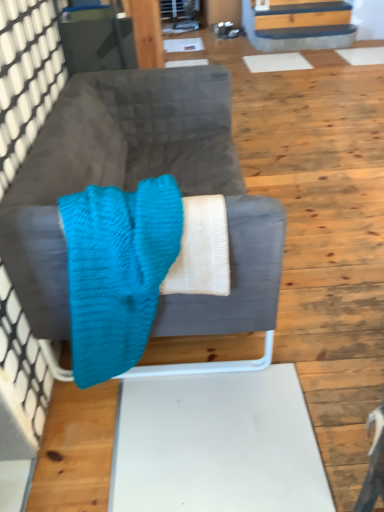
I want to click on turquoise knitted blanket at center, so click(117, 271).

This screenshot has width=384, height=512. Describe the element at coordinates (117, 271) in the screenshot. I see `turquoise knitted blanket at center` at that location.

Where is `velvet gray couch at center`? The width and height of the screenshot is (384, 512). velvet gray couch at center is located at coordinates (135, 188).

What do you see at coordinates (135, 188) in the screenshot? I see `velvet gray couch at center` at bounding box center [135, 188].

What is the approximate height of velvet gray couch at center?

velvet gray couch at center is 70.00 centimeters in height.

Find the location of `turquoise knitted blanket at center`. turquoise knitted blanket at center is located at coordinates (117, 271).

Considering the positions of objects velvet gray couch at center and turquoise knitted blanket at center in the image provided, who is more to the right, velvet gray couch at center or turquoise knitted blanket at center?

Positioned to the right is velvet gray couch at center.

Is velvet gray couch at center in front of or behind turquoise knitted blanket at center in the image?

Visually, velvet gray couch at center is located behind turquoise knitted blanket at center.

Which point is more distant from viewer, (x=104, y=84) or (x=172, y=225)?

Point (x=104, y=84)

From the image's perspective, is velvet gray couch at center on turquoise knitted blanket at center?

Yes, from the image's perspective, velvet gray couch at center is above turquoise knitted blanket at center.

From a real-world perspective, is velvet gray couch at center beneath turquoise knitted blanket at center?

Yes, from a real-world perspective, velvet gray couch at center is under turquoise knitted blanket at center.

Based on the photo, which object is wider, velvet gray couch at center or turquoise knitted blanket at center?

velvet gray couch at center is wider.

Does velvet gray couch at center have a greater height compared to turquoise knitted blanket at center?

Yes.

Who is smaller, velvet gray couch at center or turquoise knitted blanket at center?

With smaller size is turquoise knitted blanket at center.

Is velvet gray couch at center completely or partially outside of turquoise knitted blanket at center?

Absolutely, velvet gray couch at center is external to turquoise knitted blanket at center.

Are velvet gray couch at center and turquoise knitted blanket at center located far from each other?

They are positioned close to each other.

Is velvet gray couch at center oriented away from turquoise knitted blanket at center?

No.

What's the angular difference between velvet gray couch at center and turquoise knitted blanket at center's facing directions?

90.5 degrees separate the facing orientations of velvet gray couch at center and turquoise knitted blanket at center.

Find the location of a particular element. blanket in front of the velvet gray couch at center is located at coordinates (117, 271).

Can you confirm if turquoise knitted blanket at center is positioned to the left of velvet gray couch at center?

Correct, you'll find turquoise knitted blanket at center to the left of velvet gray couch at center.

Is the position of turquoise knitted blanket at center more distant than that of velvet gray couch at center?

That is False.

Does point (132, 334) come behind point (15, 236)?

Yes, point (132, 334) is farther from viewer.

From the image's perspective, is turquoise knitted blanket at center located beneath velvet gray couch at center?

Yes, from the image's perspective, turquoise knitted blanket at center is beneath velvet gray couch at center.

From a real-world perspective, who is located lower, turquoise knitted blanket at center or velvet gray couch at center?

velvet gray couch at center, from a real-world perspective.

Does turquoise knitted blanket at center have a lesser width compared to velvet gray couch at center?

Yes, turquoise knitted blanket at center is thinner than velvet gray couch at center.

Considering the sizes of objects turquoise knitted blanket at center and velvet gray couch at center in the image provided, who is taller, turquoise knitted blanket at center or velvet gray couch at center?

Standing taller between the two is velvet gray couch at center.

In terms of size, does turquoise knitted blanket at center appear bigger or smaller than velvet gray couch at center?

Considering their sizes, turquoise knitted blanket at center takes up less space than velvet gray couch at center.

In the scene shown: Can velvet gray couch at center be found inside turquoise knitted blanket at center?

No, velvet gray couch at center is not a part of turquoise knitted blanket at center.

Is turquoise knitted blanket at center next to velvet gray couch at center and touching it?

No, turquoise knitted blanket at center is not making contact with velvet gray couch at center.

Is turquoise knitted blanket at center facing away from velvet gray couch at center?

Absolutely, turquoise knitted blanket at center is directed away from velvet gray couch at center.

Identify the location of studio couch on the right of turquoise knitted blanket at center. [x=135, y=188].

This screenshot has width=384, height=512. I want to click on blanket lying below the velvet gray couch at center (from the image's perspective), so click(x=117, y=271).

At what (x,y) coordinates should I click in order to perform the action: click on studio couch below the turquoise knitted blanket at center (from a real-world perspective). Please return your answer as a coordinate pair (x, y). This screenshot has height=512, width=384. Looking at the image, I should click on (135, 188).